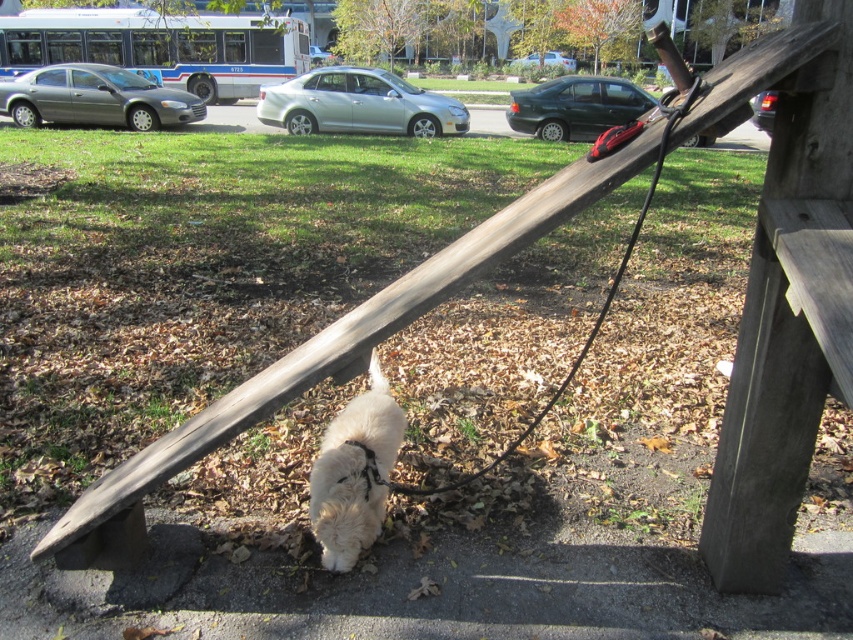
Question: Can you confirm if white fluffy dog at lower center is wider than black rubber leash at lower center?

Choices:
 (A) no
 (B) yes

Answer: (A)

Question: Does white fluffy dog at lower center have a smaller size compared to black rubber leash at lower center?

Choices:
 (A) yes
 (B) no

Answer: (A)

Question: Does white fluffy dog at lower center have a smaller size compared to black rubber leash at lower center?

Choices:
 (A) no
 (B) yes

Answer: (B)